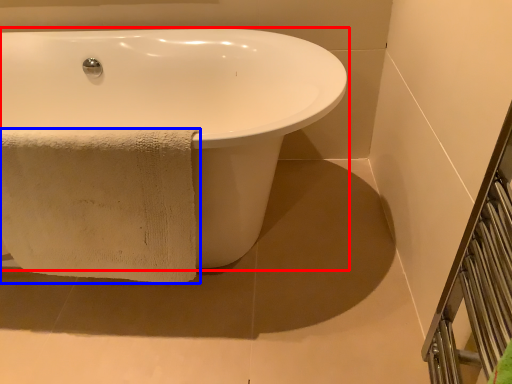
Question: Which object appears farthest to the camera in this image, bathtub (highlighted by a red box) or towel (highlighted by a blue box)?

Choices:
 (A) bathtub
 (B) towel

Answer: (B)